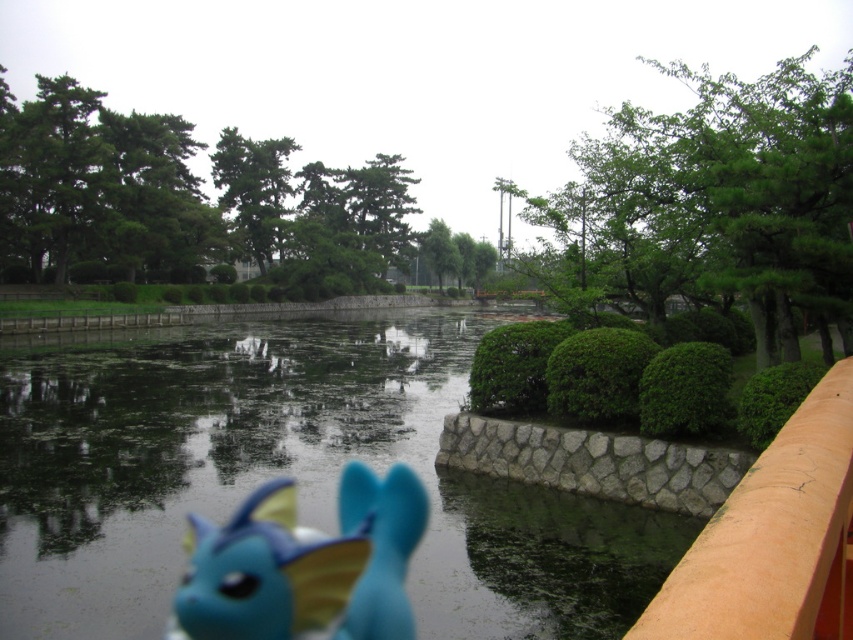
Question: Considering the real-world distances, which object is farthest from the blue matte plush toy at lower center?

Choices:
 (A) blue plush toy at center
 (B) green leafy tree at center
 (C) green matte tree at upper center
 (D) green matte tree at upper left

Answer: (B)

Question: Based on their relative distances, which object is farther from the green leafy tree at upper right?

Choices:
 (A) green matte tree at upper center
 (B) blue plush toy at center
 (C) blue matte plush toy at lower center

Answer: (B)

Question: Is blue matte plush toy at lower center wider than blue plush toy at center?

Choices:
 (A) no
 (B) yes

Answer: (B)

Question: Is green matte tree at upper left to the right of green leafy tree at center from the viewer's perspective?

Choices:
 (A) yes
 (B) no

Answer: (B)

Question: Is green leafy tree at upper right to the right of blue plush toy at center from the viewer's perspective?

Choices:
 (A) yes
 (B) no

Answer: (A)

Question: Which object is farther from the camera taking this photo?

Choices:
 (A) green matte tree at upper center
 (B) blue plush toy at center
 (C) blue matte plush toy at lower center
 (D) green matte tree at upper left

Answer: (A)